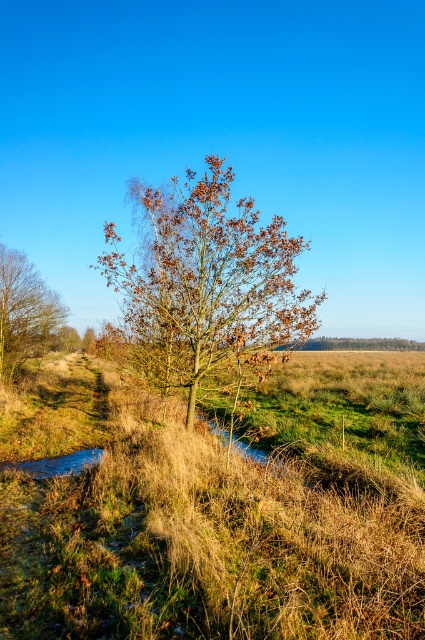
Question: Can you confirm if brown leafy tree at left is positioned to the right of shiny blue puddle at lower left?

Choices:
 (A) yes
 (B) no

Answer: (B)

Question: Is brown leafy tree at left positioned in front of shiny blue puddle at lower left?

Choices:
 (A) yes
 (B) no

Answer: (B)

Question: Which object is farther from the camera taking this photo?

Choices:
 (A) brown leafy tree at center
 (B) shiny blue puddle at lower left
 (C) brown leafy tree at left

Answer: (C)

Question: Which point appears farthest from the camera in this image?

Choices:
 (A) (0, 365)
 (B) (189, 186)
 (C) (48, 474)

Answer: (A)

Question: Based on their relative distances, which object is farther from the shiny blue puddle at lower left?

Choices:
 (A) brown leafy tree at left
 (B) brown leafy tree at center

Answer: (A)

Question: Is brown leafy tree at center smaller than brown leafy tree at left?

Choices:
 (A) yes
 (B) no

Answer: (B)